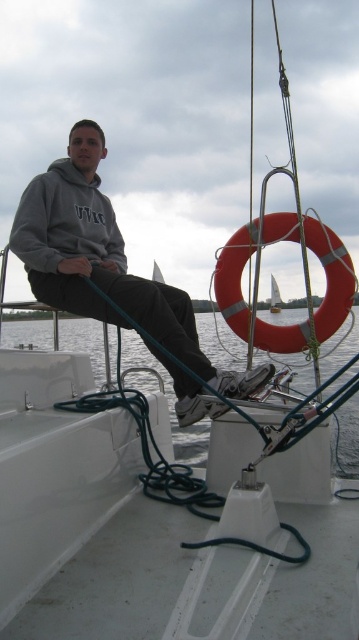
Question: Is gray matte hoodie at center below white water at lower center?

Choices:
 (A) no
 (B) yes

Answer: (A)

Question: Which of these objects is positioned closest to the white water at lower center?

Choices:
 (A) rubber ring at right
 (B) gray matte hoodie at center

Answer: (A)

Question: Is gray matte hoodie at center smaller than white water at lower center?

Choices:
 (A) yes
 (B) no

Answer: (A)

Question: Which point is farther to the camera?

Choices:
 (A) (241, 236)
 (B) (258, 376)
 (C) (344, 380)

Answer: (C)

Question: Which object is the farthest from the rubber ring at right?

Choices:
 (A) gray matte hoodie at center
 (B) white water at lower center

Answer: (B)

Question: Where is gray matte hoodie at center located in relation to white water at lower center in the image?

Choices:
 (A) right
 (B) left

Answer: (B)